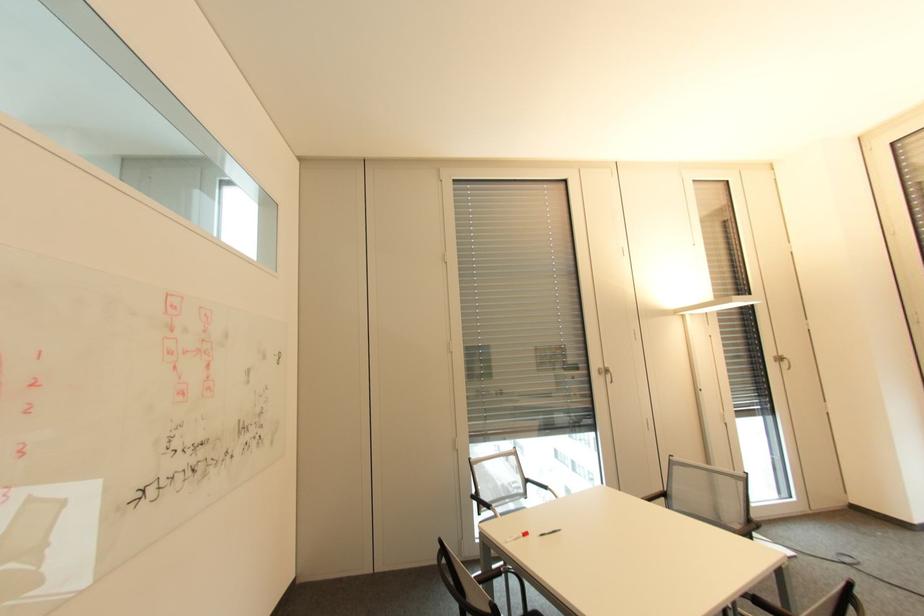
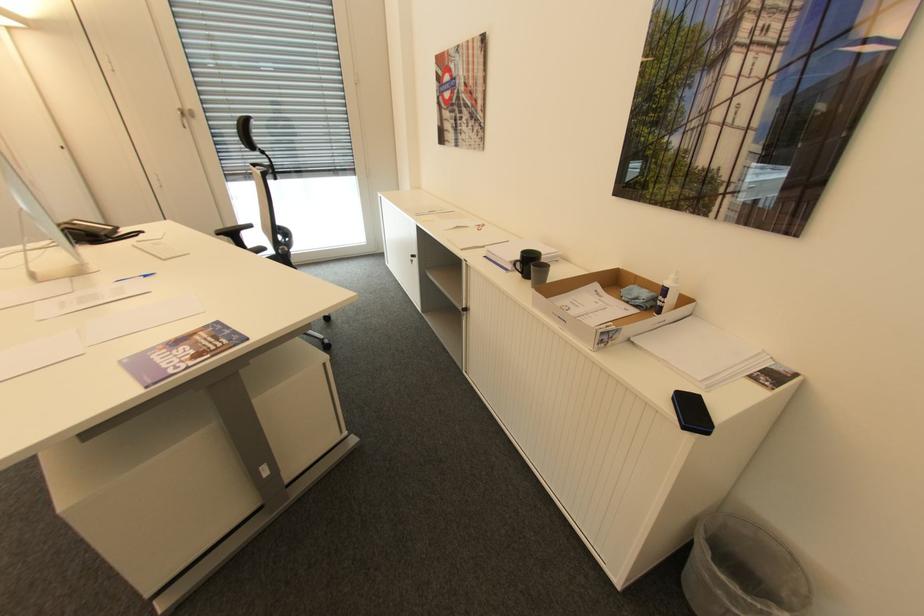
The images are taken continuously from a first-person perspective. In which direction is your viewpoint rotating?

The camera rotated toward right-down.